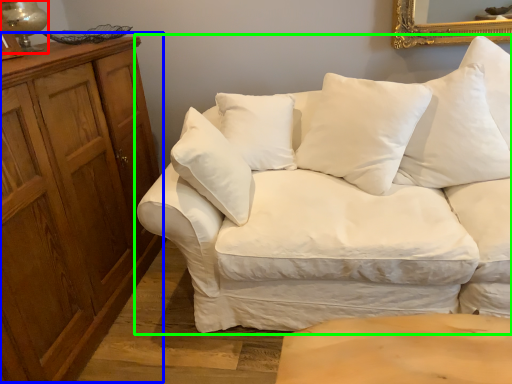
Question: Considering the real-world distances, which object is closest to table lamp (highlighted by a red box)? dresser (highlighted by a blue box) or studio couch (highlighted by a green box).

Choices:
 (A) dresser
 (B) studio couch

Answer: (A)